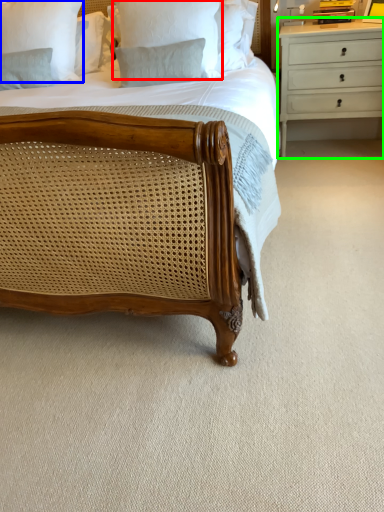
Question: Estimate the real-world distances between objects in this image. Which object is farther from pillow (highlighted by a red box), pillow (highlighted by a blue box) or chest of drawers (highlighted by a green box)?

Choices:
 (A) pillow
 (B) chest of drawers

Answer: (B)